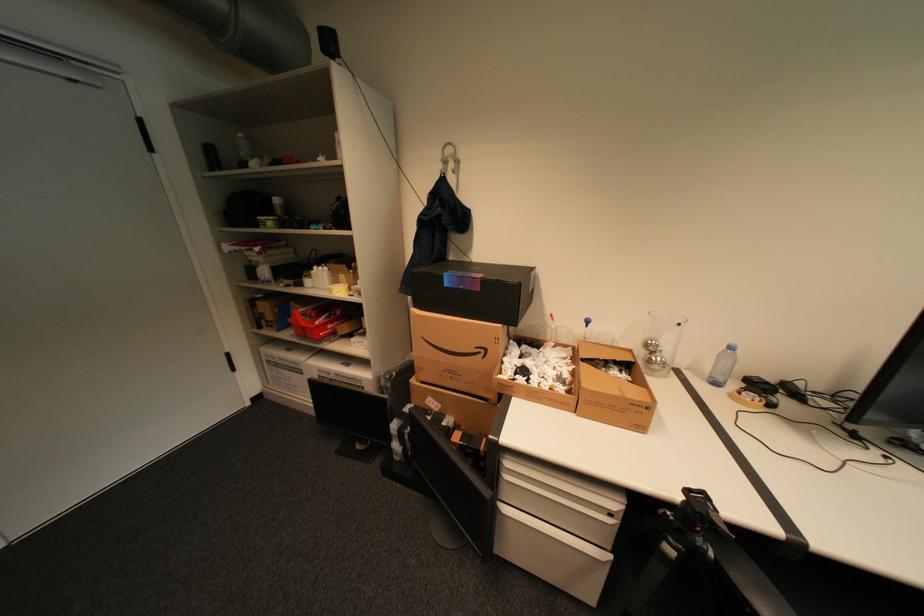
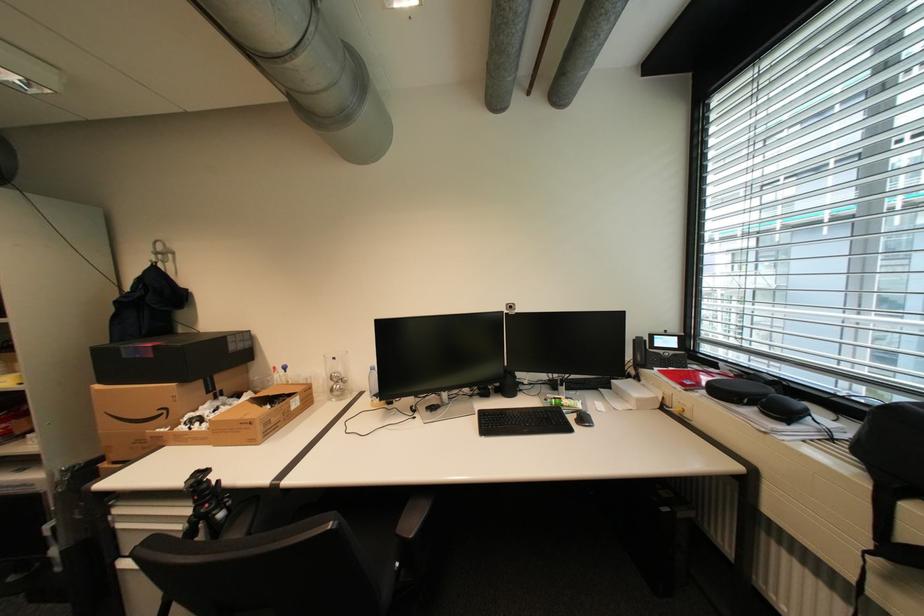
Find the pixel in the second image that matches point 655,408 in the first image.

(259, 424)